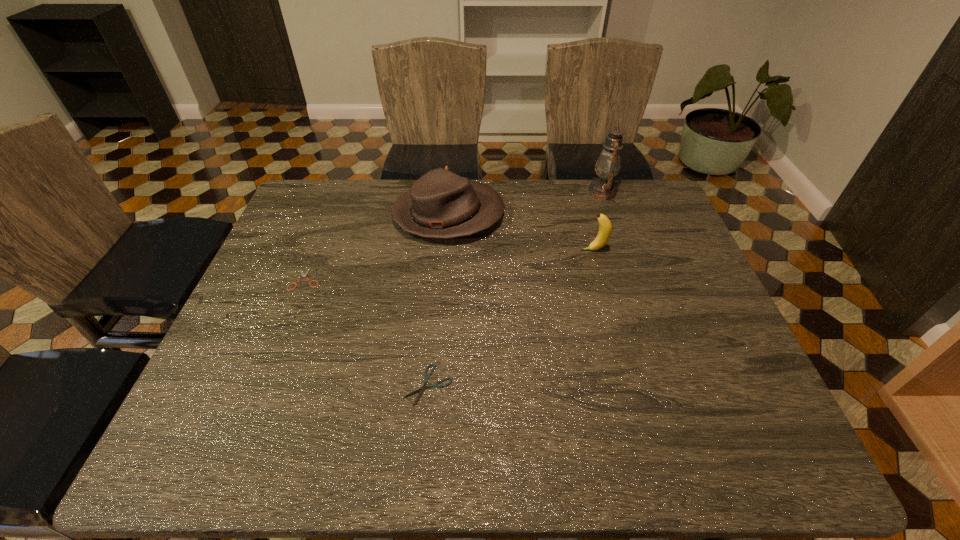
Where is `oil lamp`? Image resolution: width=960 pixels, height=540 pixels. oil lamp is located at coordinates (608, 164).

Identify the location of hat. The width and height of the screenshot is (960, 540). (441, 204).

You are a GUI agent. You are given a task and a screenshot of the screen. Output one action in this format:
    pyautogui.click(x=<x>, y=<y>)
    Task: Click on the banana
    Image resolution: width=960 pixels, height=540 pixels.
    Given the screenshot: What is the action you would take?
    [x=605, y=228]

Find the location of a particular element. the nearest object is located at coordinates (424, 386).

At what (x,y) coordinates should I click in order to perform the action: click on the nearer shears. Please return your answer as a coordinate pair (x, y). Image resolution: width=960 pixels, height=540 pixels. Looking at the image, I should click on (424, 386).

This screenshot has width=960, height=540. Identify the location of the leftmost object. (303, 275).

Find the location of `the second nearest object`. the second nearest object is located at coordinates (303, 275).

Locate an element on the screen. The image size is (960, 540). blank area located on the left of the oil lamp is located at coordinates (556, 192).

Identify the location of vacant space positioned 0.150m on the decorative side of the hat. Image resolution: width=960 pixels, height=540 pixels. (552, 215).

At what (x,y) coordinates should I click in order to perform the action: click on vacant space located from the stem of the banana. Please return your answer as a coordinate pair (x, y). Looking at the image, I should click on (467, 250).